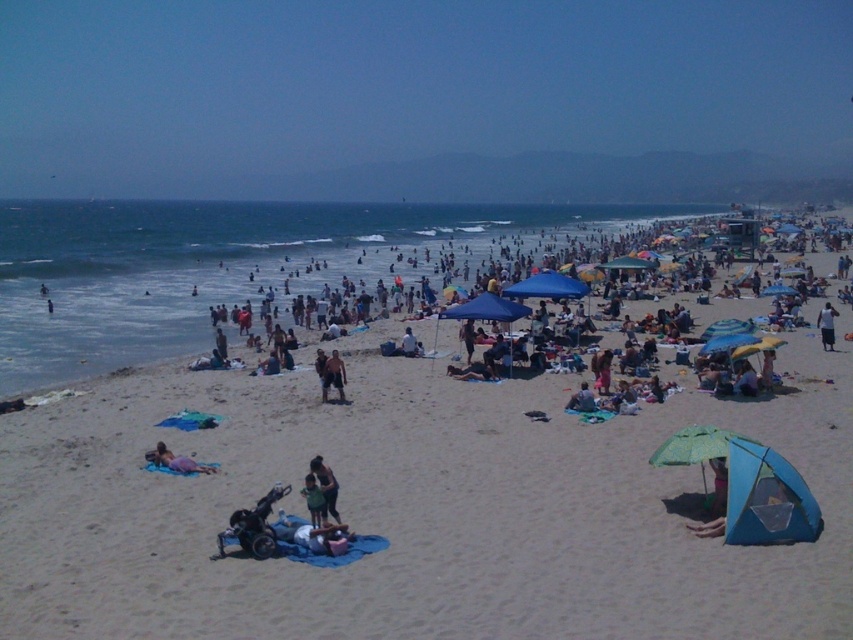
Question: Which object is closer to the camera taking this photo?

Choices:
 (A) dark green fabric dress at center
 (B) green fabric shirt at center
 (C) pink fabric at lower left

Answer: (B)

Question: Which object is closer to the camera taking this photo?

Choices:
 (A) blue fabric tent at lower right
 (B) white cotton shirt at upper right
 (C) beachgoers at center

Answer: (A)

Question: Does beachgoers at center appear over blue fabric umbrella at center?

Choices:
 (A) no
 (B) yes

Answer: (B)

Question: Does blue fabric umbrella at center appear over white cotton shirt at upper right?

Choices:
 (A) no
 (B) yes

Answer: (B)

Question: Can you confirm if blue fabric umbrella at center is positioned to the left of blue fabric tent at lower right?

Choices:
 (A) yes
 (B) no

Answer: (B)

Question: Which object appears closest to the camera in this image?

Choices:
 (A) green fabric shirt at center
 (B) beachgoers at center

Answer: (A)